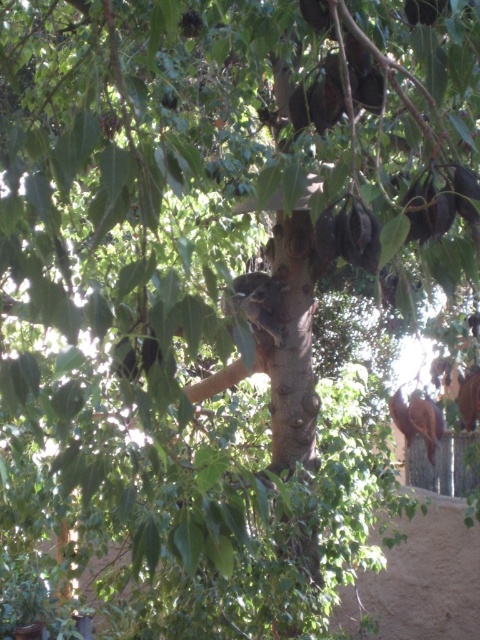
Question: Which object is closer to the camera taking this photo?

Choices:
 (A) green matte fruit at upper center
 (B) brown fuzzy fruit at upper center

Answer: (B)

Question: Does brown fuzzy fruit at upper center appear over green matte fruit at upper center?

Choices:
 (A) yes
 (B) no

Answer: (B)

Question: Which point appears closest to the camera in this image?

Choices:
 (A) (195, 29)
 (B) (408, 17)

Answer: (B)

Question: Does brown fuzzy fruit at upper center appear over green matte fruit at upper center?

Choices:
 (A) yes
 (B) no

Answer: (B)

Question: Can you confirm if brown fuzzy fruit at upper center is positioned to the left of green matte fruit at upper center?

Choices:
 (A) yes
 (B) no

Answer: (B)

Question: Which object is farther from the camera taking this photo?

Choices:
 (A) brown fuzzy fruit at upper center
 (B) green matte fruit at upper center

Answer: (B)